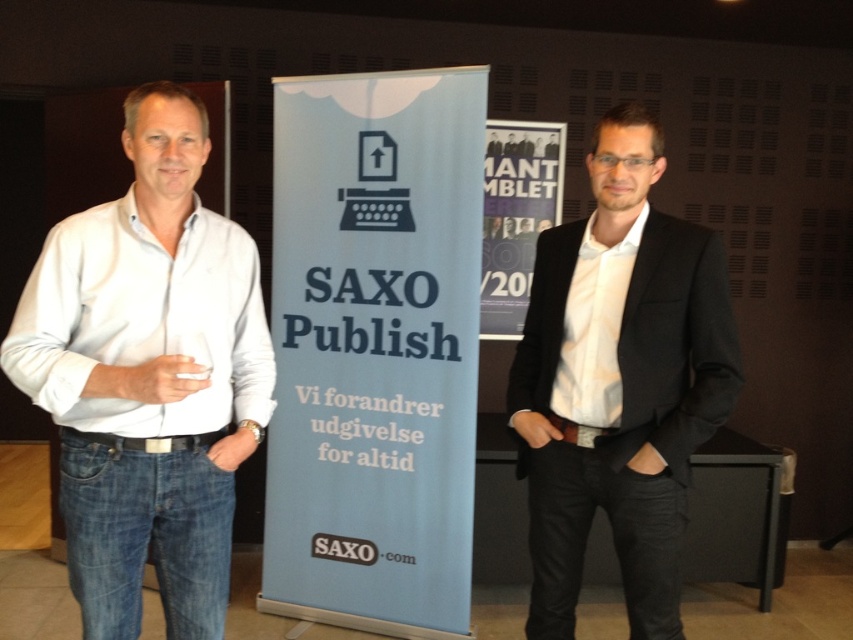
You are an event photographer at the SAXO Publish event. You need to focus your camera on the white cotton shirt at left. Where should you aim your camera based on the 2D coordinates provided?

You should aim your camera at the 2D coordinates point (148, 376) to focus on the white cotton shirt at left.

You are designing a poster that needs to fit within a frame. You have the blue paper banner at center and the black smooth blazer at center in the image. Which object has a greater width and can potentially occupy more space in the frame?

The blue paper banner at center has a greater width than the black smooth blazer at center, so it can potentially occupy more space in the frame.

You are a photographer setting up for an event. You need to ensure that the blue paper banner at center is visible above the white cotton shirt at left. Based on the scene description, is this possible?

The blue paper banner at center is taller than the white cotton shirt at left, so it will be visible above the white cotton shirt at left.